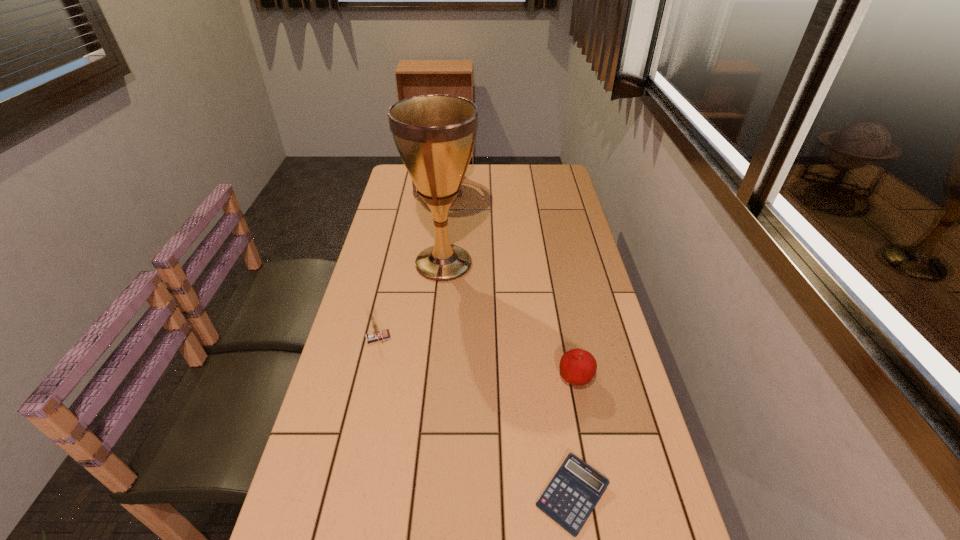
This screenshot has width=960, height=540. In order to click on vacant space that satisfies the following two spatial constraints: 1. on the front-facing side of the second tallest object; 2. on the right side of the apple in this screenshot , I will do `click(412, 380)`.

Identify the location of free space that satisfies the following two spatial constraints: 1. on the front-facing side of the trophy cup; 2. on the left side of the second tallest object. The width and height of the screenshot is (960, 540). (428, 264).

Where is `vacant region that satisfies the following two spatial constraints: 1. on the front-facing side of the fourth farthest object; 2. on the right side of the second tallest object`? This screenshot has height=540, width=960. vacant region that satisfies the following two spatial constraints: 1. on the front-facing side of the fourth farthest object; 2. on the right side of the second tallest object is located at coordinates (412, 380).